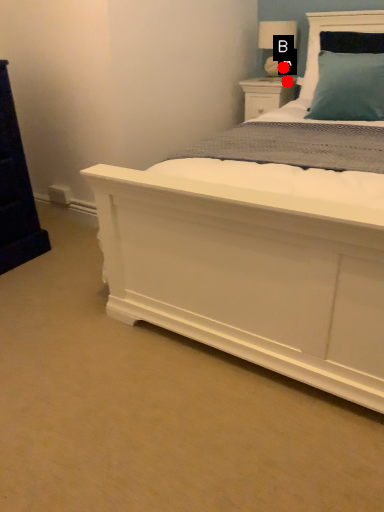
Question: Two points are circled on the image, labeled by A and B beside each circle. Which point is farther from the camera taking this photo?

Choices:
 (A) A is further
 (B) B is further

Answer: (B)